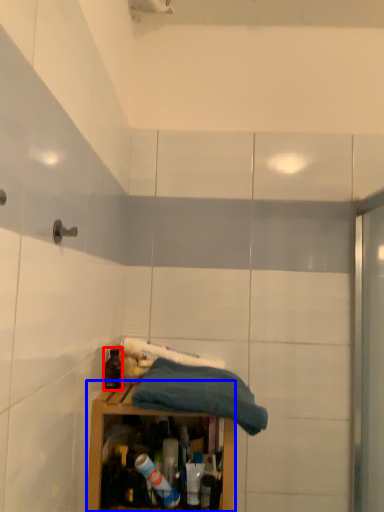
Question: Which point is further to the camera, bottle (highlighted by a red box) or cabinetry (highlighted by a blue box)?

Choices:
 (A) bottle
 (B) cabinetry

Answer: (A)